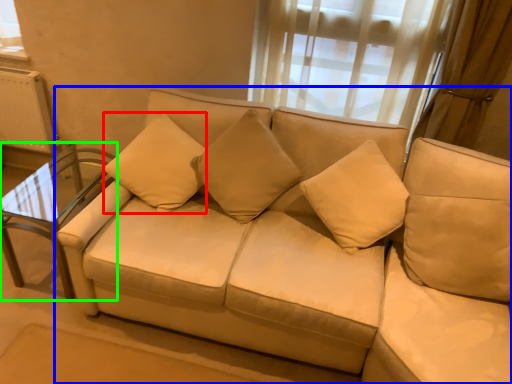
Question: Which is nearer to the pillow (highlighted by a red box)? studio couch (highlighted by a blue box) or table (highlighted by a green box).

Choices:
 (A) studio couch
 (B) table

Answer: (B)